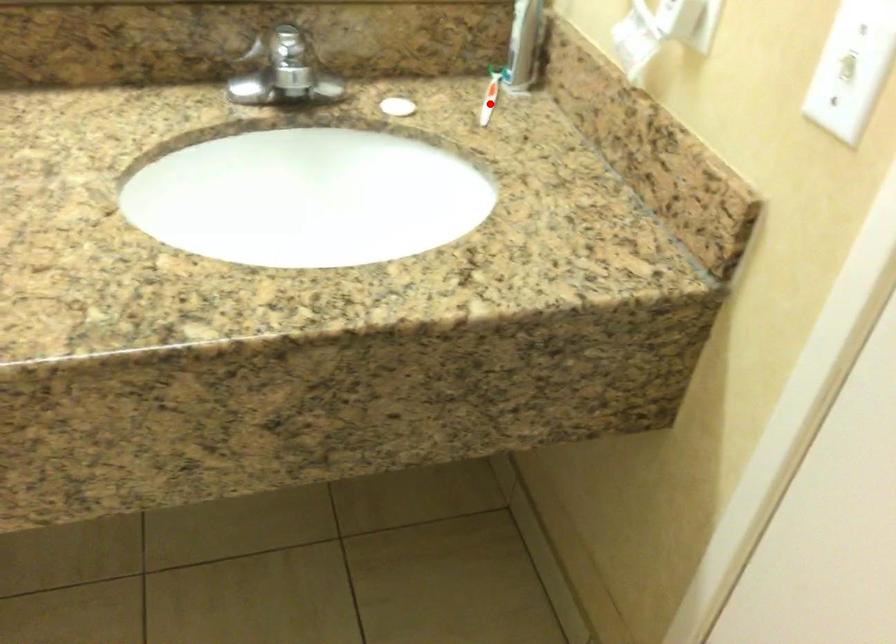
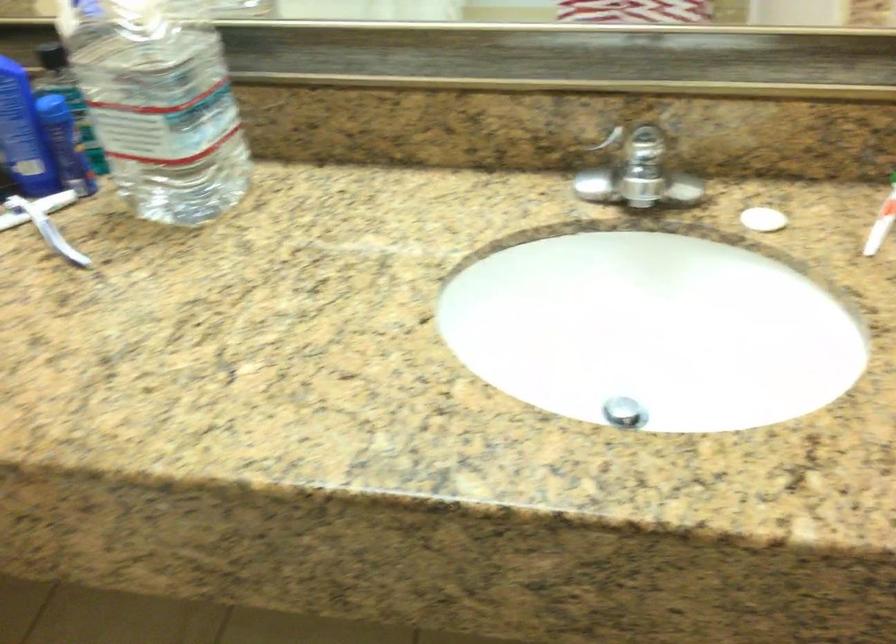
Locate, in the second image, the point that corresponds to the highlighted location in the first image.

(881, 222)